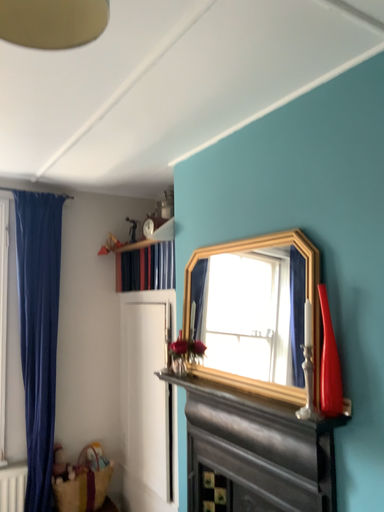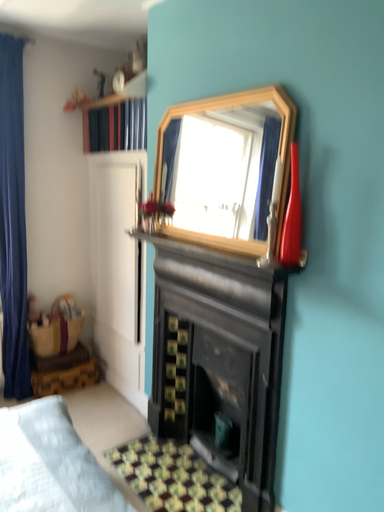
Question: How did the camera likely rotate when shooting the video?

Choices:
 (A) rotated upward
 (B) rotated downward

Answer: (B)